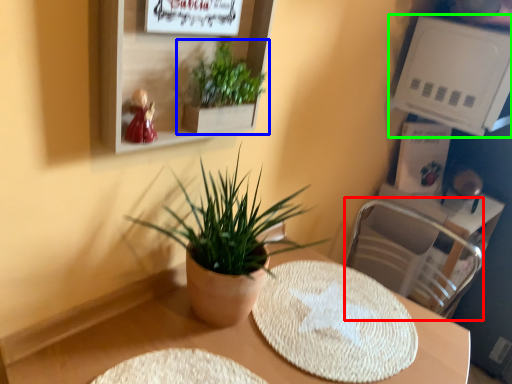
Question: Considering the real-world distances, which object is farthest from swivel chair (highlighted by a red box)? houseplant (highlighted by a blue box) or shelf (highlighted by a green box)?

Choices:
 (A) houseplant
 (B) shelf

Answer: (A)